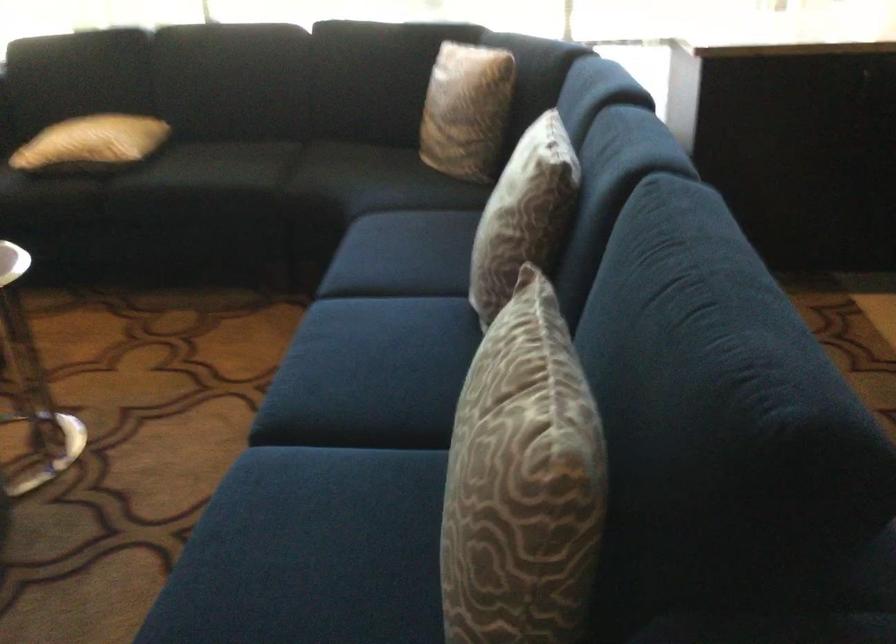
Where would you sit the sofa sitting surface? Please return your answer as a coordinate pair (x, y).

(341, 458)